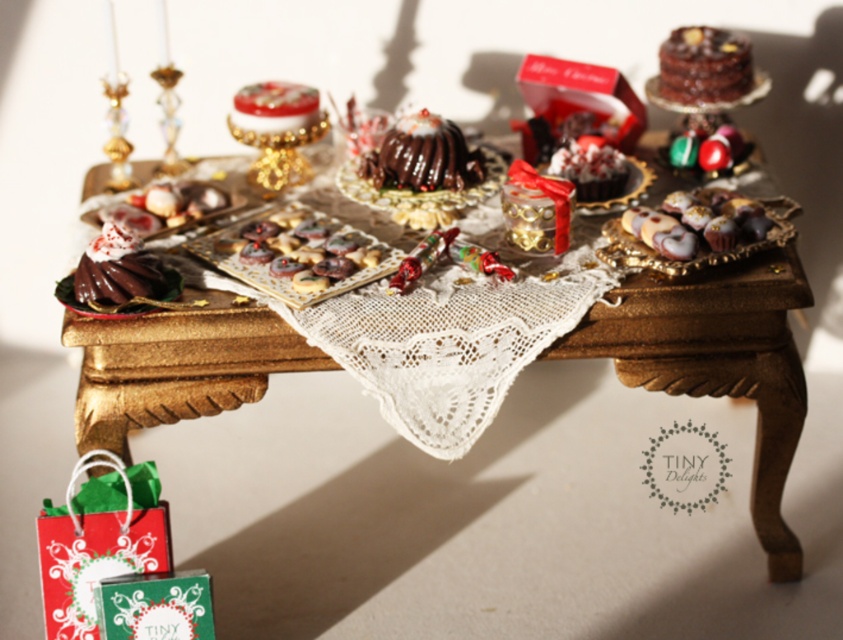
Who is positioned more to the left, chocolate glossy cake at center or shiny gold cake at center?

shiny gold cake at center

Where is `chocolate glossy cake at center`? chocolate glossy cake at center is located at coordinates (702, 65).

Between point (705, 29) and point (299, 96), which one is positioned behind?

The point (299, 96) is behind.

Locate an element on the screen. This screenshot has width=843, height=640. chocolate glossy cake at center is located at coordinates (702, 65).

Does chocolate glossy cake at center appear on the left side of chocolate matte cupcake at center?

In fact, chocolate glossy cake at center is to the right of chocolate matte cupcake at center.

Is chocolate glossy cake at center closer to the viewer compared to chocolate matte cupcake at center?

No, it is behind chocolate matte cupcake at center.

Is point (678, 28) closer to camera compared to point (591, 145)?

No, (678, 28) is further to viewer.

The width and height of the screenshot is (843, 640). Find the location of `chocolate glossy cake at center`. chocolate glossy cake at center is located at coordinates pyautogui.click(x=702, y=65).

Is shiny chocolate cake at center below chocolate glossy cake at center?

Yes, shiny chocolate cake at center is below chocolate glossy cake at center.

Describe the element at coordinates (422, 156) in the screenshot. The width and height of the screenshot is (843, 640). I see `shiny chocolate cake at center` at that location.

Which is behind, point (438, 116) or point (723, 61)?

Positioned behind is point (723, 61).

Where is `shiny chocolate cake at center`? The height and width of the screenshot is (640, 843). shiny chocolate cake at center is located at coordinates (422, 156).